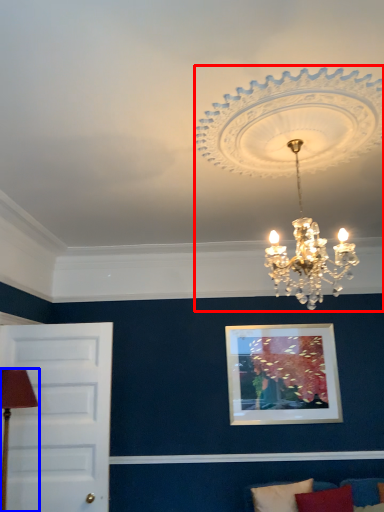
Question: Among these objects, which one is nearest to the camera, lamp (highlighted by a red box) or table lamp (highlighted by a blue box)?

Choices:
 (A) lamp
 (B) table lamp

Answer: (A)